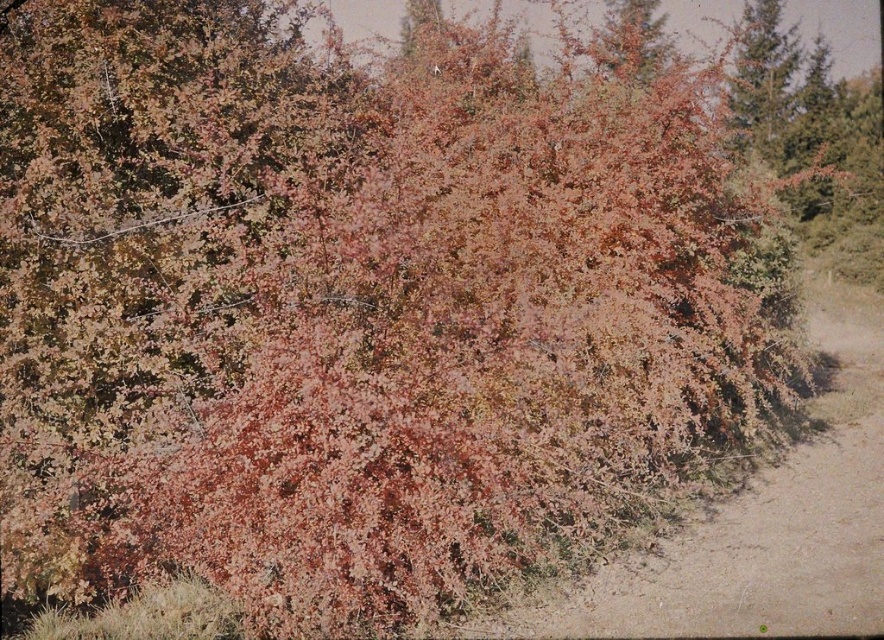
Question: Among these objects, which one is farthest from the camera?

Choices:
 (A) green textured tree at upper right
 (B) leaves at upper right
 (C) brown sandy dirt track at lower right

Answer: (A)

Question: Which of these objects is positioned closest to the green textured tree at upper right?

Choices:
 (A) leaves at upper right
 (B) brown sandy dirt track at lower right

Answer: (A)

Question: Does brown sandy dirt track at lower right appear on the left side of green textured tree at upper right?

Choices:
 (A) no
 (B) yes

Answer: (B)

Question: Which object is the farthest from the brown sandy dirt track at lower right?

Choices:
 (A) green textured tree at upper right
 (B) leaves at upper right

Answer: (B)

Question: Does brown sandy dirt track at lower right appear under leaves at upper right?

Choices:
 (A) no
 (B) yes

Answer: (B)

Question: Is brown sandy dirt track at lower right further to camera compared to leaves at upper right?

Choices:
 (A) no
 (B) yes

Answer: (A)